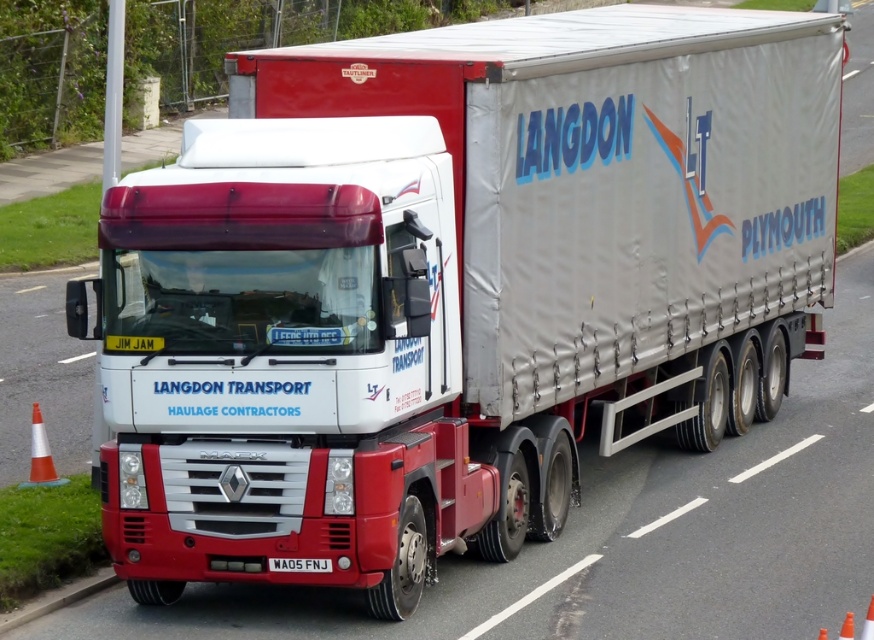
Question: Considering the relative positions of orange/white plastic traffic cone at lower left and black metal license plate at center in the image provided, where is orange/white plastic traffic cone at lower left located with respect to black metal license plate at center?

Choices:
 (A) right
 (B) left

Answer: (B)

Question: Estimate the real-world distances between objects in this image. Which object is closer to the black metal license plate at center?

Choices:
 (A) orange plastic traffic cone at lower right
 (B) orange/white plastic traffic cone at lower left

Answer: (B)

Question: Which point appears farthest from the camera in this image?

Choices:
 (A) (865, 627)
 (B) (42, 448)

Answer: (B)

Question: Is orange/white plastic traffic cone at lower left wider than orange plastic traffic cone at lower right?

Choices:
 (A) yes
 (B) no

Answer: (A)

Question: Which point is farther from the camera taking this photo?

Choices:
 (A) (281, 563)
 (B) (46, 451)

Answer: (B)

Question: Can you confirm if black metal license plate at center is positioned to the left of orange plastic traffic cone at lower right?

Choices:
 (A) no
 (B) yes

Answer: (B)